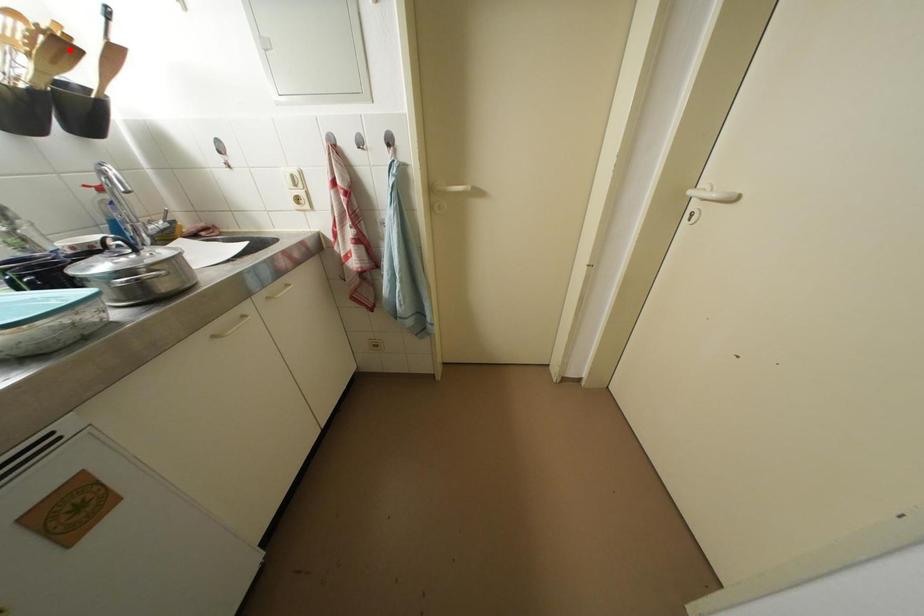
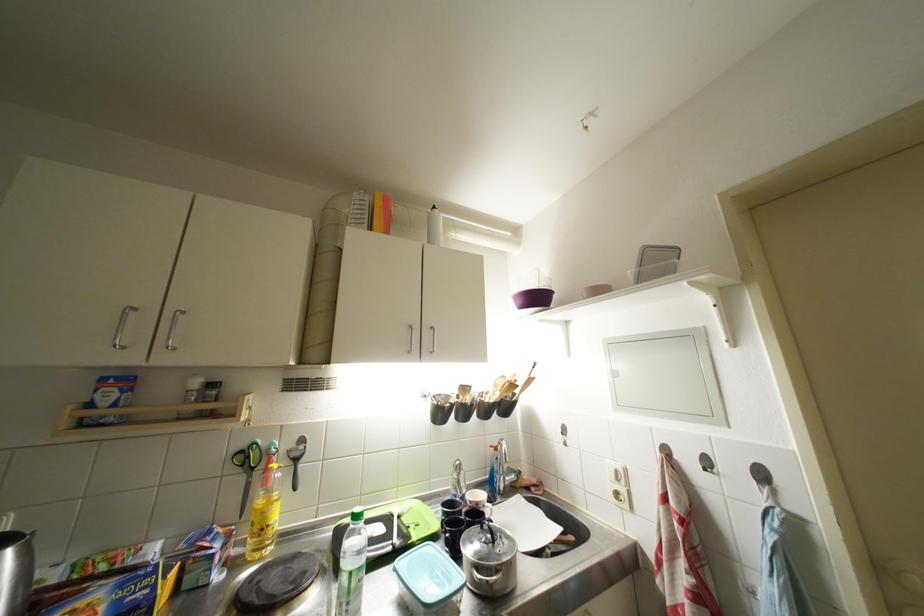
In the second image, find the point that corresponds to the highlighted location in the first image.

(519, 390)